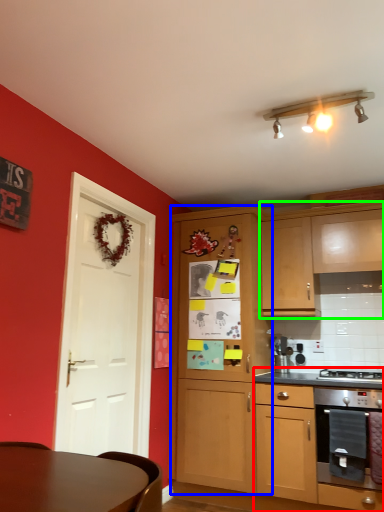
Question: Considering the real-world distances, which object is farthest from cabinetry (highlighted by a red box)? cabinetry (highlighted by a blue box) or cabinetry (highlighted by a green box)?

Choices:
 (A) cabinetry
 (B) cabinetry

Answer: (B)